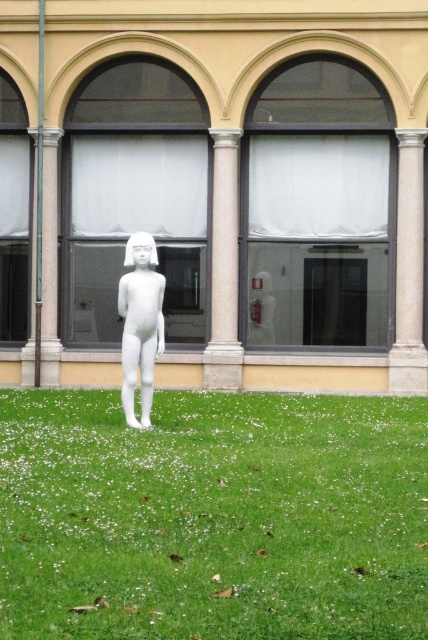
Question: Which is nearer to the smooth stone pillar at center?

Choices:
 (A) white marble pillar at center
 (B) white matte sculpture at center
 (C) green grass at center
 (D) white marble column at center

Answer: (D)

Question: Which point is closer to the camera?

Choices:
 (A) green grass at center
 (B) white marble column at center
 (C) white marble pillar at center
 (D) white matte sculpture at center

Answer: (A)

Question: Is the position of white marble column at center less distant than that of smooth stone pillar at center?

Choices:
 (A) no
 (B) yes

Answer: (B)

Question: Does white marble pillar at center have a smaller size compared to white marble column at center?

Choices:
 (A) no
 (B) yes

Answer: (B)

Question: Based on their relative distances, which object is farther from the white marble column at center?

Choices:
 (A) green grass at center
 (B) smooth stone pillar at center

Answer: (A)

Question: From the image, what is the correct spatial relationship of green grass at center in relation to smooth stone pillar at center?

Choices:
 (A) above
 (B) below

Answer: (B)